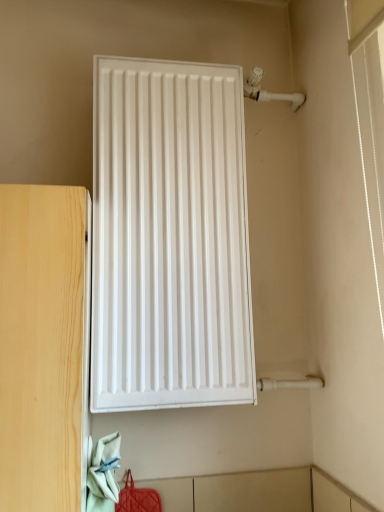
Describe the element at coordinates (169, 237) in the screenshot. Image resolution: width=384 pixels, height=512 pixels. I see `white matte radiator at upper center` at that location.

In order to face white matte radiator at upper center, should I rotate leftwards or rightwards?

A 2.205 degree turn to the right will do.

Find the location of a particular element. This screenshot has width=384, height=512. white matte radiator at upper center is located at coordinates (169, 237).

Locate an element on the screen. white matte radiator at upper center is located at coordinates (169, 237).